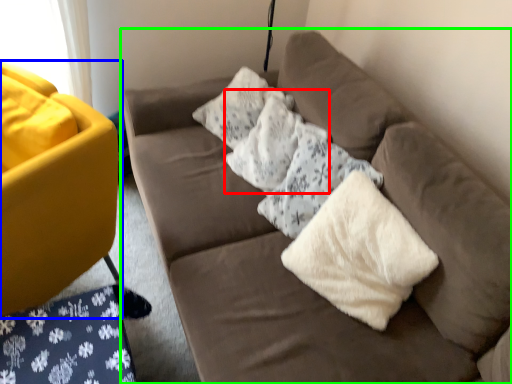
Question: Which object is the farthest from pillow (highlighted by a red box)? Choose among these: studio couch (highlighted by a blue box) or studio couch (highlighted by a green box).

Choices:
 (A) studio couch
 (B) studio couch

Answer: (A)